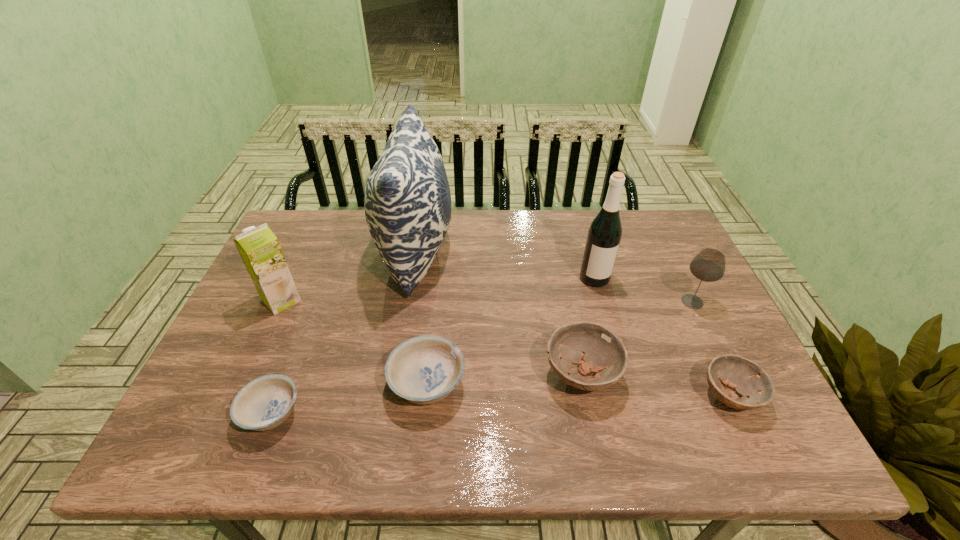
Find the location of `cushion`. cushion is located at coordinates (407, 201).

Identify the location of dark wine bottle. This screenshot has width=960, height=540. (604, 235).

I want to click on soya milk, so click(x=259, y=248).

You are a GUI agent. You are given a task and a screenshot of the screen. Output one action in this format:
    pyautogui.click(x=<x>, y=<y>)
    Task: Click on the third tallest object
    The image size is (960, 540).
    Given the screenshot: What is the action you would take?
    pyautogui.click(x=259, y=248)

Locate an element on the screen. The image size is (960, 540). the fourth tallest object is located at coordinates point(708,265).

This screenshot has height=540, width=960. I want to click on gray wineglass, so click(x=708, y=265).

Locate an element on the screen. This screenshot has width=960, height=540. the bigger brown bowl is located at coordinates (596, 349).

I want to click on the tallest bowl, so click(x=596, y=349).

What are the coordinates of `the second bowl from left to right` in the screenshot? It's located at (424, 370).

Where is `the bigger blue bowl`? the bigger blue bowl is located at coordinates (424, 370).